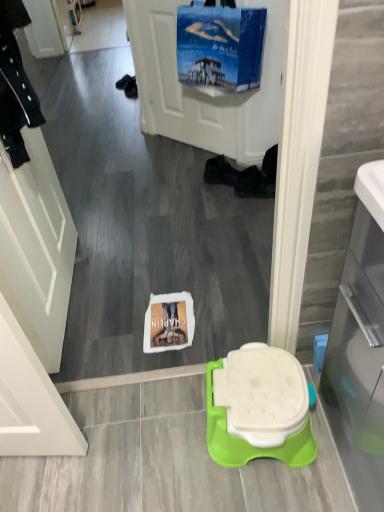
Where is `empty space that is in between blue fabric screen door at upper center, the first screen door from the top, and white matte screen door at left, which is counted as the second screen door, starting from the top`? This screenshot has height=512, width=384. empty space that is in between blue fabric screen door at upper center, the first screen door from the top, and white matte screen door at left, which is counted as the second screen door, starting from the top is located at coordinates (134, 208).